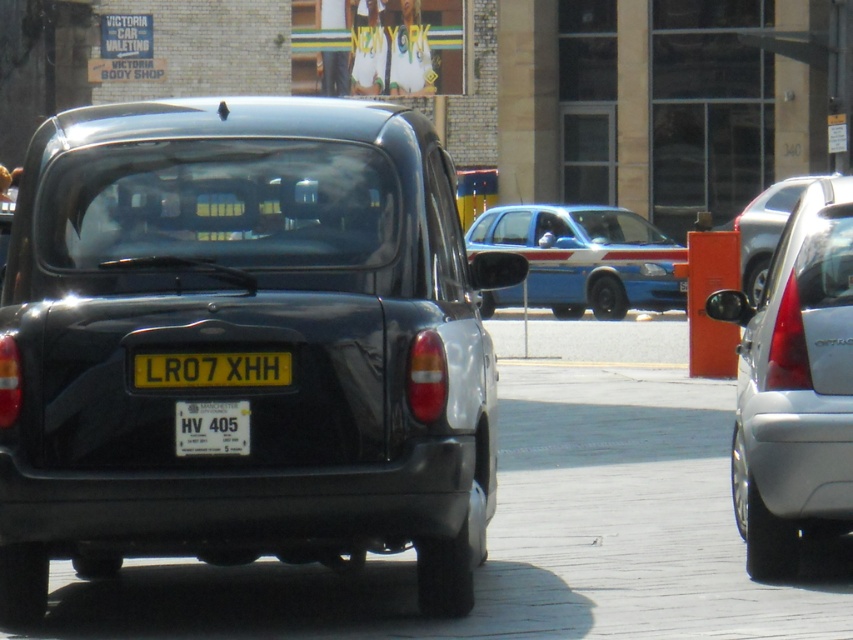
Is point (106, 426) positioned after point (683, 259)?

That is False.

Who is positioned more to the right, matte black car at center or blue glossy car at center?

blue glossy car at center is more to the right.

At what (x,y) coordinates should I click in order to perform the action: click on matte black car at center. Please return your answer as a coordinate pair (x, y). The width and height of the screenshot is (853, 640). Looking at the image, I should click on (244, 342).

At what (x,y) coordinates should I click in order to perform the action: click on matte black car at center. Please return your answer as a coordinate pair (x, y). Image resolution: width=853 pixels, height=640 pixels. Looking at the image, I should click on (244, 342).

Is blue glossy car at center to the left of shiny silver car at right from the viewer's perspective?

Yes, blue glossy car at center is to the left of shiny silver car at right.

Does point (563, 236) lie in front of point (750, 241)?

That is False.

Between point (639, 305) and point (795, 198), which one is positioned in front?

Positioned in front is point (795, 198).

Where is `blue glossy car at center`? Image resolution: width=853 pixels, height=640 pixels. blue glossy car at center is located at coordinates (585, 257).

Between shiny silver car at right and white plastic license plate at center, which one is positioned higher?

shiny silver car at right is above.

Does shiny silver car at right appear over white plastic license plate at center?

Yes, shiny silver car at right is above white plastic license plate at center.

Is point (782, 218) less distant than point (215, 433)?

No, (782, 218) is behind (215, 433).

What are the coordinates of `shiny silver car at right` in the screenshot? It's located at (767, 227).